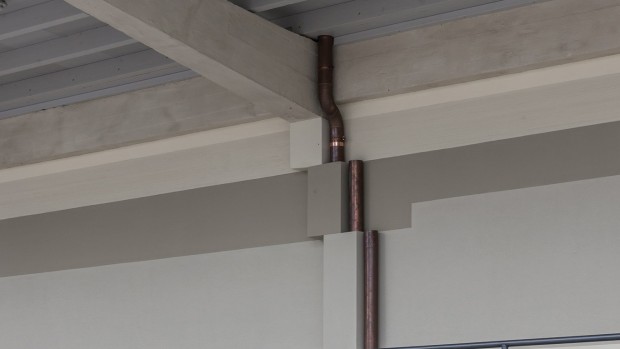
The image size is (620, 349). I want to click on wood planks, so click(x=141, y=65), click(x=87, y=33), click(x=51, y=5).